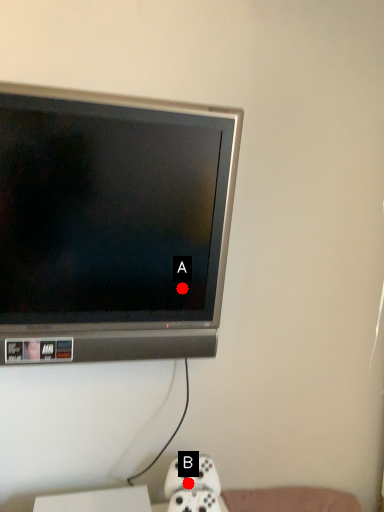
Question: Two points are circled on the image, labeled by A and B beside each circle. Which point is farther from the camera taking this photo?

Choices:
 (A) A is further
 (B) B is further

Answer: (B)